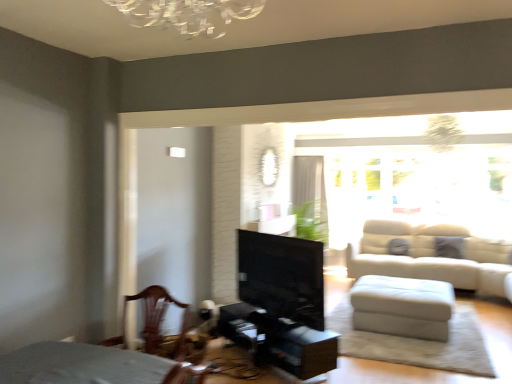
Question: Can you confirm if black glossy fireplace at center is wider than white sheer curtain at upper center?

Choices:
 (A) yes
 (B) no

Answer: (B)

Question: Can you confirm if black glossy fireplace at center is shorter than white sheer curtain at upper center?

Choices:
 (A) yes
 (B) no

Answer: (A)

Question: Is the depth of black glossy fireplace at center less than that of white sheer curtain at upper center?

Choices:
 (A) no
 (B) yes

Answer: (B)

Question: Can you confirm if black glossy fireplace at center is taller than white sheer curtain at upper center?

Choices:
 (A) no
 (B) yes

Answer: (A)

Question: Does black glossy fireplace at center have a lesser width compared to white sheer curtain at upper center?

Choices:
 (A) yes
 (B) no

Answer: (A)

Question: Considering the relative sizes of black glossy fireplace at center and white sheer curtain at upper center in the image provided, is black glossy fireplace at center bigger than white sheer curtain at upper center?

Choices:
 (A) yes
 (B) no

Answer: (B)

Question: Considering the relative positions of black glossy fireplace at center and white leather ottoman at lower right in the image provided, is black glossy fireplace at center behind white leather ottoman at lower right?

Choices:
 (A) no
 (B) yes

Answer: (A)

Question: Can you confirm if black glossy fireplace at center is wider than white leather ottoman at lower right?

Choices:
 (A) no
 (B) yes

Answer: (A)

Question: Is black glossy fireplace at center beside white leather ottoman at lower right?

Choices:
 (A) no
 (B) yes

Answer: (A)

Question: Is black glossy fireplace at center thinner than white leather ottoman at lower right?

Choices:
 (A) no
 (B) yes

Answer: (B)

Question: Could you tell me if black glossy fireplace at center is turned towards white leather ottoman at lower right?

Choices:
 (A) yes
 (B) no

Answer: (A)

Question: Considering the relative sizes of black glossy fireplace at center and white leather ottoman at lower right in the image provided, is black glossy fireplace at center taller than white leather ottoman at lower right?

Choices:
 (A) no
 (B) yes

Answer: (B)

Question: Considering the relative sizes of transparent glass window at upper right and black glossy fireplace at center in the image provided, is transparent glass window at upper right bigger than black glossy fireplace at center?

Choices:
 (A) yes
 (B) no

Answer: (A)